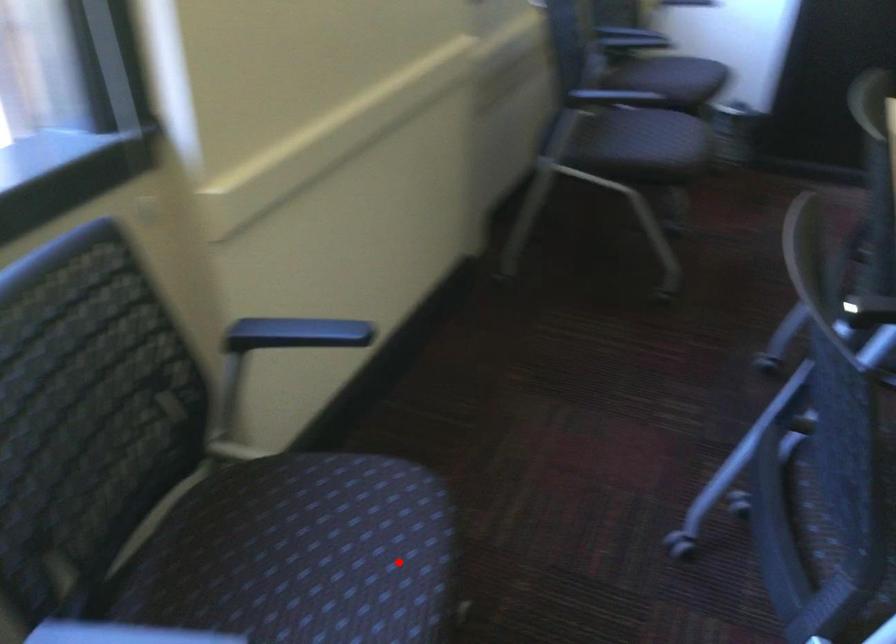
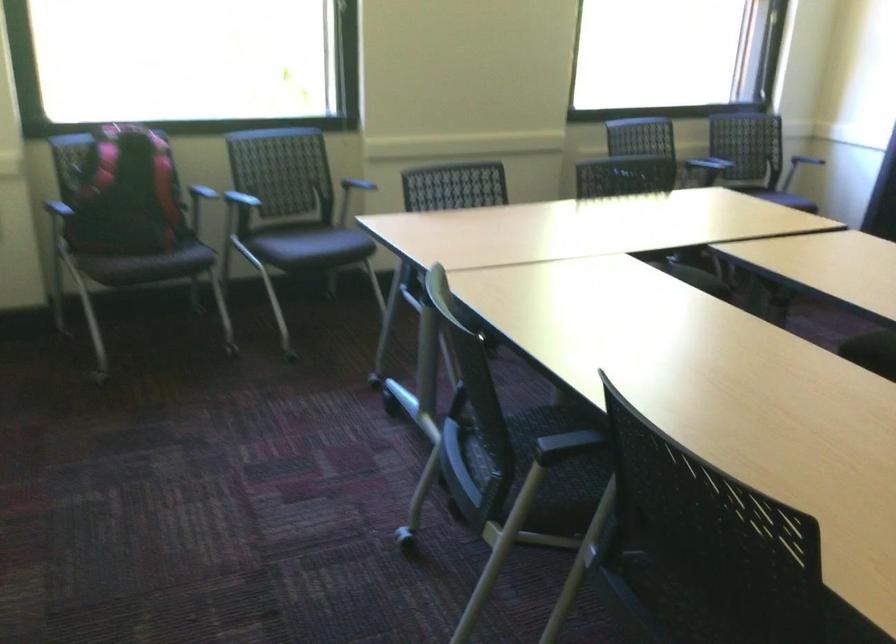
The point at the highlighted location is marked in the first image. Where is the corresponding point in the second image?

(323, 243)